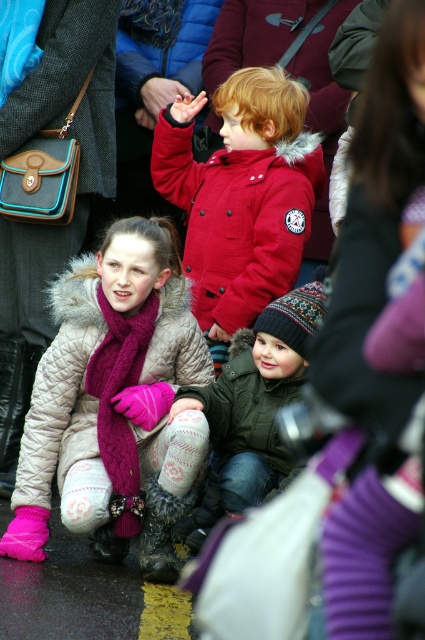
At what (x,y) coordinates should I click in order to perform the action: click on green fuzzy jacket at center. Please return your answer as a coordinate pair (x, y). Looking at the image, I should click on (252, 408).

Consider the image. Is green fuzzy jacket at center thinner than knitted magenta scarf at lower left?

No.

I want to click on green fuzzy jacket at center, so click(x=252, y=408).

Where is `green fuzzy jacket at center`? The height and width of the screenshot is (640, 425). green fuzzy jacket at center is located at coordinates (252, 408).

Who is more distant from viewer, (235, 193) or (169, 504)?

Point (235, 193)

Who is positioned more to the right, red matte jacket at center or fuzzy black boot at lower center?

red matte jacket at center

The image size is (425, 640). What do you see at coordinates (238, 218) in the screenshot?
I see `red matte jacket at center` at bounding box center [238, 218].

You are a GUI agent. You are given a task and a screenshot of the screen. Output one action in this format:
    pyautogui.click(x=<x>, y=<y>)
    Task: Click on the red matte jacket at center
    
    Given the screenshot: What is the action you would take?
    pyautogui.click(x=238, y=218)

Is the position of red matte jacket at center more distant than that of knitted magenta scarf at lower left?

Yes, red matte jacket at center is behind knitted magenta scarf at lower left.

In the scene shown: Is red matte jacket at center taller than knitted magenta scarf at lower left?

Yes.

Is point (212, 204) closer to camera compared to point (127, 355)?

No, (212, 204) is further to viewer.

At what (x,y) coordinates should I click in order to perform the action: click on red matte jacket at center. Please return your answer as a coordinate pair (x, y). Image resolution: width=425 pixels, height=640 pixels. Looking at the image, I should click on (238, 218).